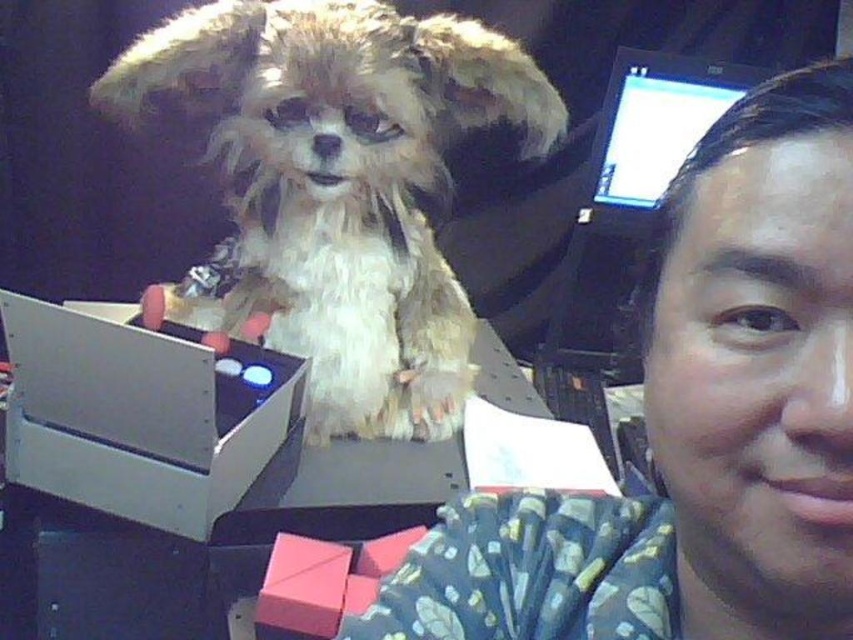
Question: Which object appears farthest from the camera in this image?

Choices:
 (A) fuzzy beige dog at center
 (B) fluffy fur dog at upper left
 (C) metallic gray box at center-left
 (D) matte black monitor at upper right

Answer: (D)

Question: Does fuzzy beige dog at center appear under matte black monitor at upper right?

Choices:
 (A) yes
 (B) no

Answer: (A)

Question: Observing the image, what is the correct spatial positioning of fuzzy beige dog at center in reference to matte black monitor at upper right?

Choices:
 (A) above
 (B) below

Answer: (B)

Question: Is fluffy fur dog at upper left below fuzzy beige dog at center?

Choices:
 (A) yes
 (B) no

Answer: (A)

Question: Which object is closer to the camera taking this photo?

Choices:
 (A) matte black monitor at upper right
 (B) metallic gray box at center-left
 (C) fuzzy beige dog at center

Answer: (B)

Question: Which object is closer to the camera taking this photo?

Choices:
 (A) metallic gray box at center-left
 (B) fluffy fur dog at upper left
 (C) fuzzy beige dog at center
 (D) matte black monitor at upper right

Answer: (B)